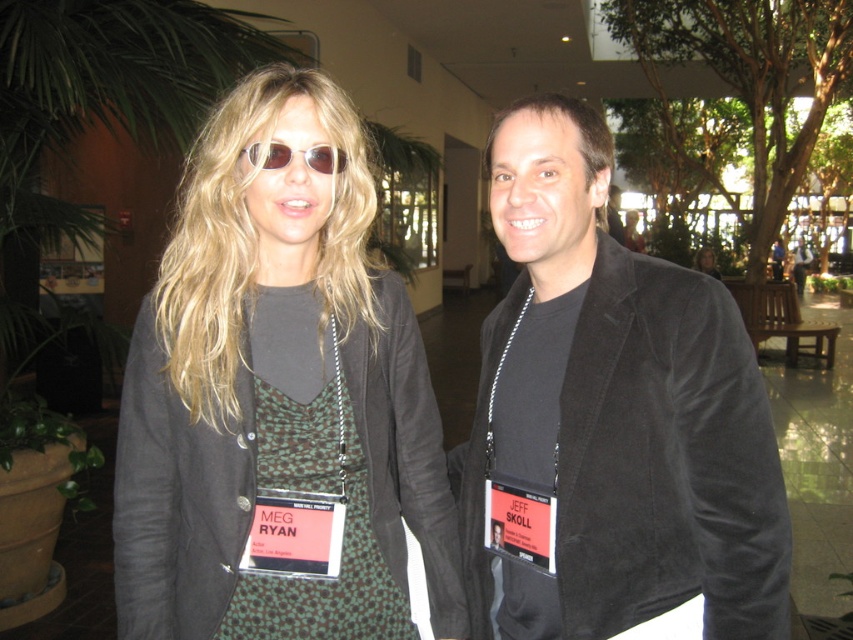
Question: Among these objects, which one is farthest from the camera?

Choices:
 (A) green dotted fabric dress at center
 (B) matte black jacket at center
 (C) matte black blazer at center
 (D) sunglasses at center

Answer: (C)

Question: Does green dotted fabric dress at center appear on the left side of sunglasses at center?

Choices:
 (A) yes
 (B) no

Answer: (A)

Question: Which object is positioned closest to the matte black blazer at center?

Choices:
 (A) green dotted fabric dress at center
 (B) suede jacket at center
 (C) sunglasses at center

Answer: (B)

Question: Is matte black jacket at center thinner than suede jacket at center?

Choices:
 (A) no
 (B) yes

Answer: (A)

Question: Can you confirm if sunglasses at center is thinner than matte black blazer at center?

Choices:
 (A) yes
 (B) no

Answer: (A)

Question: Which object is farther from the camera taking this photo?

Choices:
 (A) matte black jacket at center
 (B) matte black blazer at center

Answer: (B)